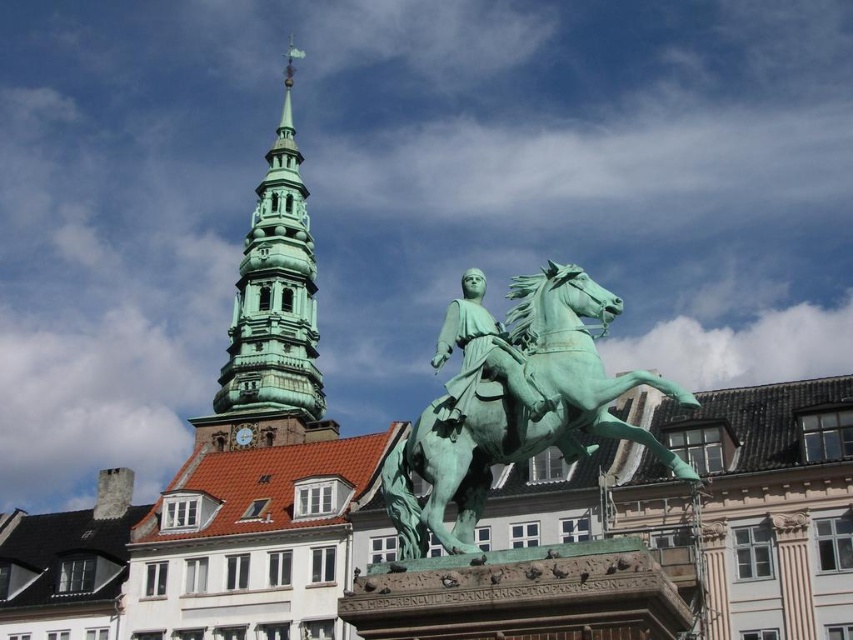
Question: Which point is closer to the camera?

Choices:
 (A) (421, 552)
 (B) (270, 291)
 (C) (453, 307)

Answer: (A)

Question: Is green patinated metal horse at center further to the viewer compared to green polished stone tower at upper left?

Choices:
 (A) yes
 (B) no

Answer: (B)

Question: Is green polished stone tower at upper left closer to the viewer compared to green patinated bronze statue at center?

Choices:
 (A) yes
 (B) no

Answer: (B)

Question: Among these objects, which one is nearest to the camera?

Choices:
 (A) green patinated bronze statue at center
 (B) green patinated metal horse at center

Answer: (B)

Question: Does green patinated metal horse at center come behind green polished stone tower at upper left?

Choices:
 (A) yes
 (B) no

Answer: (B)

Question: Among these objects, which one is farthest from the camera?

Choices:
 (A) green polished stone tower at upper left
 (B) green patinated bronze statue at center

Answer: (A)